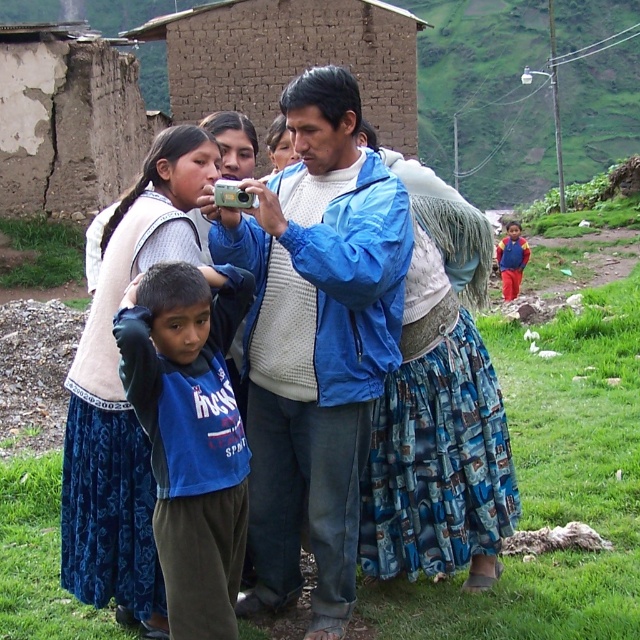
Question: Which point is farther to the camera?

Choices:
 (A) (72, 547)
 (B) (285, 104)
 (C) (516, 284)
 (D) (344, 157)

Answer: (C)

Question: Is blue matte jacket at center further to the viewer compared to blue cotton shirt at center?

Choices:
 (A) yes
 (B) no

Answer: (A)

Question: Which point appears closest to the camera in this image?

Choices:
 (A) (349, 572)
 (B) (113, 500)
 (C) (509, 292)

Answer: (B)

Question: Can you confirm if blue fabric shirt at center is positioned above blue cotton shirt at center?

Choices:
 (A) yes
 (B) no

Answer: (B)

Question: Can you confirm if blue fabric shirt at center is positioned below blue cotton shirt at center?

Choices:
 (A) yes
 (B) no

Answer: (A)

Question: Which point is closer to the camera?

Choices:
 (A) white knit sweater at center
 (B) blue fabric shirt at center
 (C) red fabric pants at right
 (D) blue cotton shirt at center

Answer: (D)